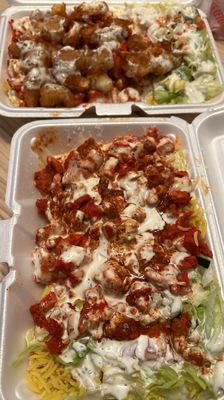
At what (x,y) coordinates should I click in order to perform the action: click on food container lid. Please return your answer as a coordinate pair (x, y). Looking at the image, I should click on (217, 140), (184, 1).